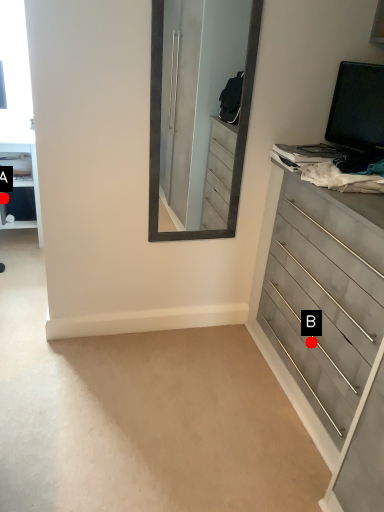
Question: Two points are circled on the image, labeled by A and B beside each circle. Which point is farther from the camera taking this photo?

Choices:
 (A) A is further
 (B) B is further

Answer: (A)